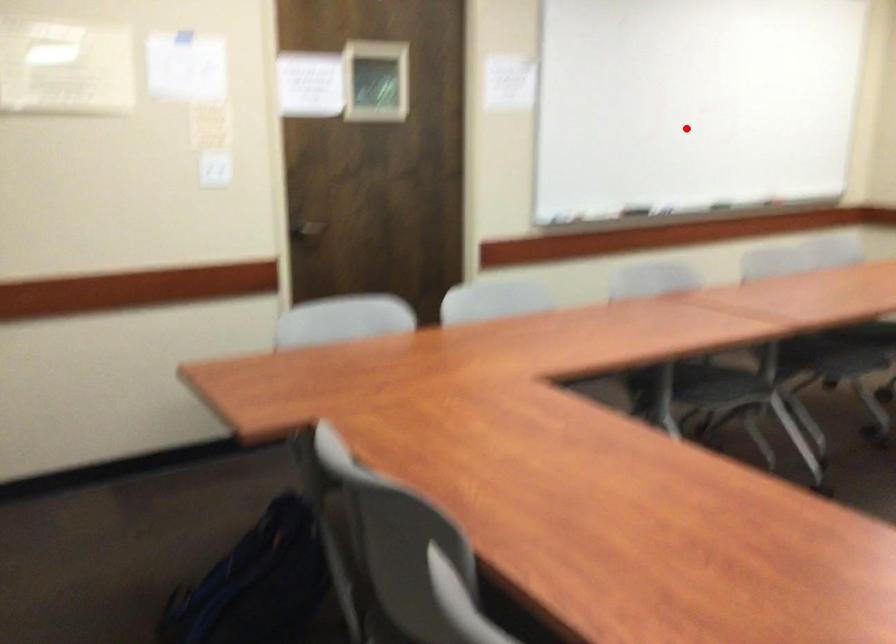
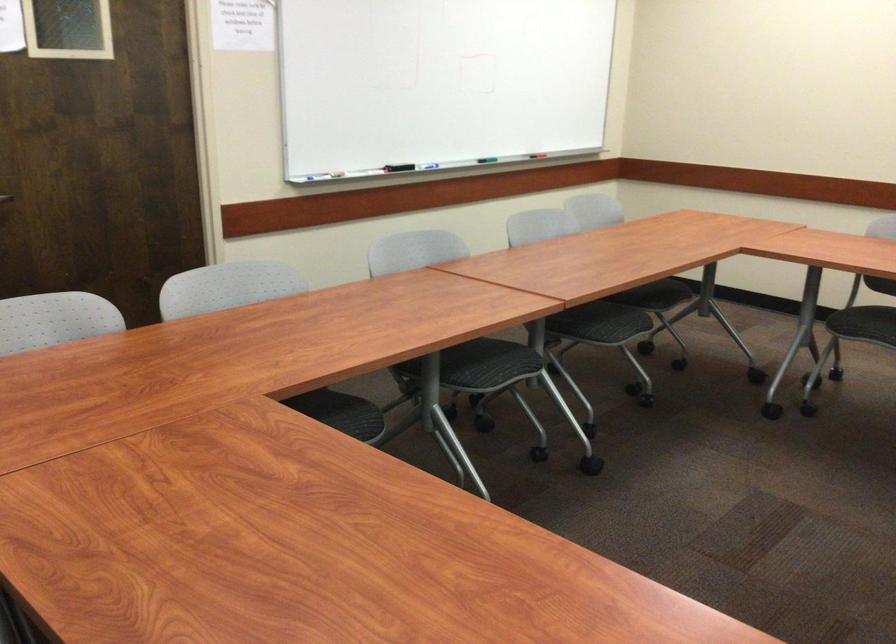
Locate, in the second image, the point that corresponds to the highlighted location in the first image.

(438, 82)